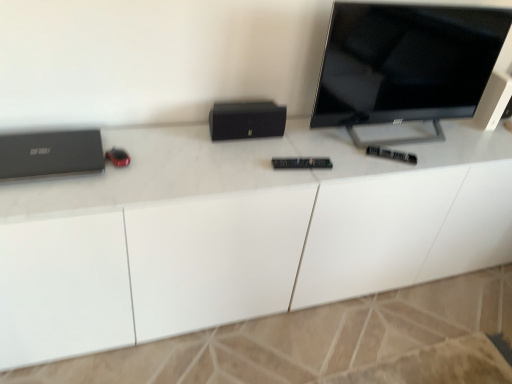
Locate an element on the screen. This screenshot has height=384, width=512. vacant space situated on the left part of black plastic remote at center is located at coordinates (347, 163).